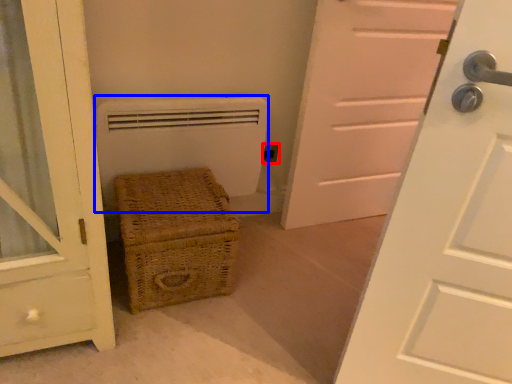
Question: Among these objects, which one is farthest to the camera, electric outlet (highlighted by a red box) or heater (highlighted by a blue box)?

Choices:
 (A) electric outlet
 (B) heater

Answer: (A)